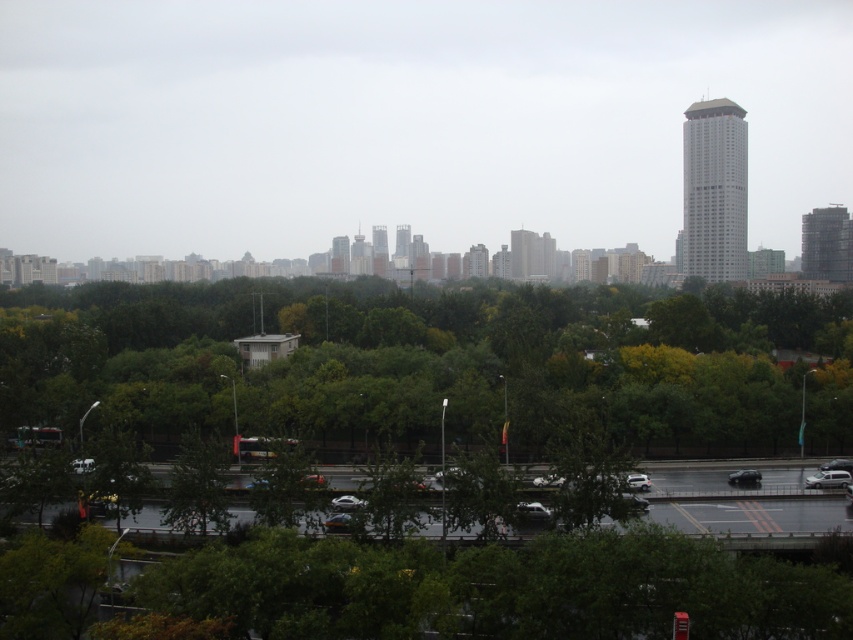
Is point (375, 28) behind point (55, 323)?

Yes.

Between transparent glass skyscraper at center and green leafy trees at center, which one has more height?

With more height is transparent glass skyscraper at center.

Locate an element on the screen. This screenshot has width=853, height=640. transparent glass skyscraper at center is located at coordinates (403, 122).